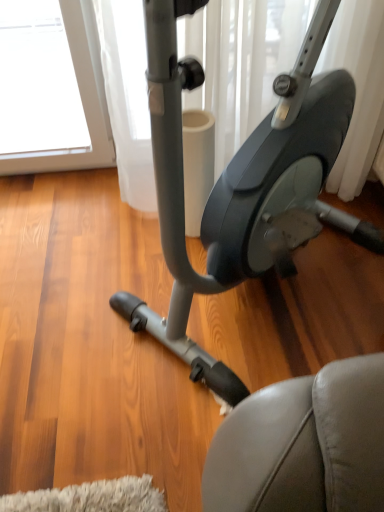
Identify the location of free spot below matte black stationary bicycle at center (from a real-world perspective). (250, 308).